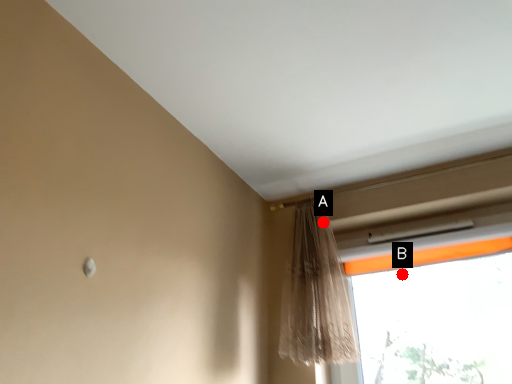
Question: Two points are circled on the image, labeled by A and B beside each circle. Which point appears closest to the camera in this image?

Choices:
 (A) A is closer
 (B) B is closer

Answer: (A)